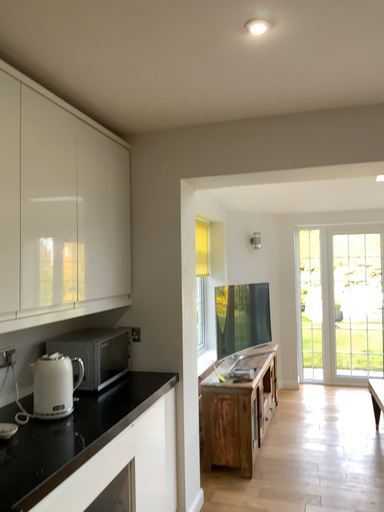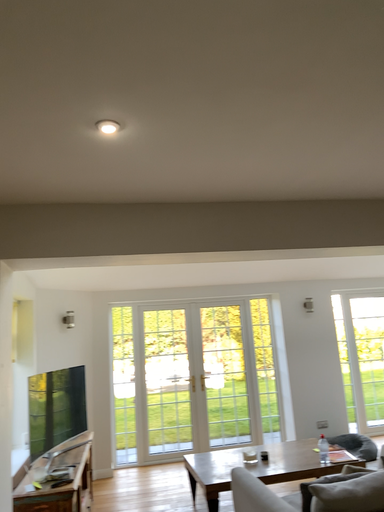
Question: Which way did the camera rotate in the video?

Choices:
 (A) rotated downward
 (B) rotated upward

Answer: (B)